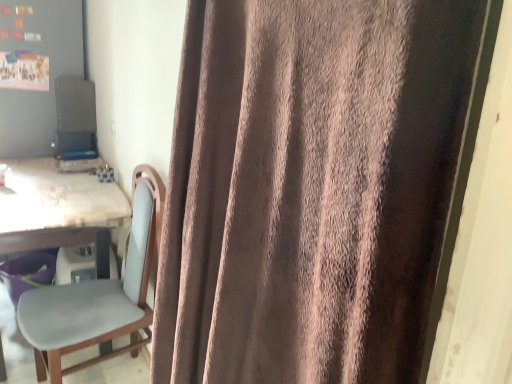
Question: Can you confirm if brown velvety curtain at center is taller than wooden table at left?

Choices:
 (A) no
 (B) yes

Answer: (B)

Question: Is wooden table at left surrounded by brown velvety curtain at center?

Choices:
 (A) yes
 (B) no

Answer: (B)

Question: Would you say brown velvety curtain at center is outside wooden table at left?

Choices:
 (A) no
 (B) yes

Answer: (B)

Question: Is brown velvety curtain at center not close to wooden table at left?

Choices:
 (A) yes
 (B) no

Answer: (A)

Question: From the image's perspective, is brown velvety curtain at center beneath wooden table at left?

Choices:
 (A) no
 (B) yes

Answer: (B)

Question: Is wooden table at left in front of or behind brown velvety curtain at center in the image?

Choices:
 (A) front
 (B) behind

Answer: (B)

Question: From the image's perspective, is wooden table at left positioned above or below brown velvety curtain at center?

Choices:
 (A) below
 (B) above

Answer: (B)

Question: From a real-world perspective, is wooden table at left above or below brown velvety curtain at center?

Choices:
 (A) below
 (B) above

Answer: (A)

Question: From their relative heights in the image, would you say wooden table at left is taller or shorter than brown velvety curtain at center?

Choices:
 (A) short
 (B) tall

Answer: (A)

Question: From a real-world perspective, is brown velvety curtain at center physically located above or below matte gray bulletin board at upper left?

Choices:
 (A) above
 (B) below

Answer: (B)

Question: Is brown velvety curtain at center taller or shorter than matte gray bulletin board at upper left?

Choices:
 (A) short
 (B) tall

Answer: (B)

Question: Would you say brown velvety curtain at center is to the left or to the right of matte gray bulletin board at upper left in the picture?

Choices:
 (A) right
 (B) left

Answer: (A)

Question: Would you say brown velvety curtain at center is inside or outside matte gray bulletin board at upper left?

Choices:
 (A) outside
 (B) inside

Answer: (A)

Question: Considering their positions, is matte gray bulletin board at upper left located in front of or behind wooden table at left?

Choices:
 (A) behind
 (B) front

Answer: (A)

Question: From the image's perspective, relative to wooden table at left, is matte gray bulletin board at upper left above or below?

Choices:
 (A) below
 (B) above

Answer: (B)